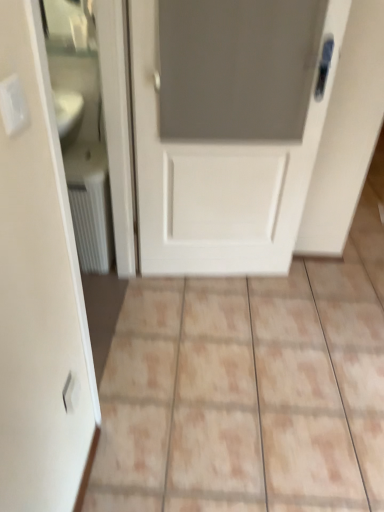
The height and width of the screenshot is (512, 384). Find the location of `free space to the left of white matte door at center`. free space to the left of white matte door at center is located at coordinates (141, 300).